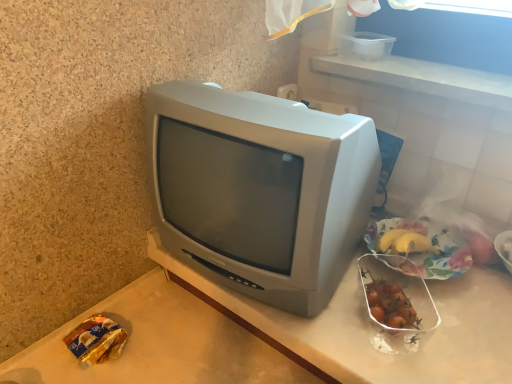
Question: From the image's perspective, is translucent plastic banana at upper right, the 4th food positioned from the left, beneath shiny plastic container of cherry tomatoes at right, the third food in the right-to-left sequence?

Choices:
 (A) yes
 (B) no

Answer: (B)

Question: Could you tell me if translucent plastic banana at upper right, the 4th food positioned from the left, is turned towards shiny plastic container of cherry tomatoes at right, arranged as the second food when viewed from the left?

Choices:
 (A) yes
 (B) no

Answer: (B)

Question: Considering the relative sizes of translucent plastic banana at upper right, the 4th food positioned from the left, and shiny plastic container of cherry tomatoes at right, arranged as the second food when viewed from the left, in the image provided, is translucent plastic banana at upper right, the 4th food positioned from the left, wider than shiny plastic container of cherry tomatoes at right, arranged as the second food when viewed from the left,?

Choices:
 (A) yes
 (B) no

Answer: (B)

Question: Is translucent plastic banana at upper right, the 1th food positioned from the right, taller than shiny plastic container of cherry tomatoes at right, the third food in the right-to-left sequence?

Choices:
 (A) yes
 (B) no

Answer: (A)

Question: Would you say translucent plastic banana at upper right, the 4th food positioned from the left, is outside shiny plastic container of cherry tomatoes at right, arranged as the second food when viewed from the left?

Choices:
 (A) yes
 (B) no

Answer: (A)

Question: From their relative heights in the image, would you say matte gray television at center is taller or shorter than yellow matte bananas at right, the third food in the left-to-right sequence?

Choices:
 (A) short
 (B) tall

Answer: (B)

Question: Based on their sizes in the image, would you say matte gray television at center is bigger or smaller than yellow matte bananas at right, which appears as the second food when viewed from the right?

Choices:
 (A) big
 (B) small

Answer: (A)

Question: Is point (199, 192) positioned closer to the camera than point (441, 253)?

Choices:
 (A) farther
 (B) closer

Answer: (B)

Question: Do you think matte gray television at center is within yellow matte bananas at right, the third food in the left-to-right sequence, or outside of it?

Choices:
 (A) outside
 (B) inside

Answer: (A)

Question: Visually, is yellow matte bananas at right, which appears as the second food when viewed from the right, positioned to the left or to the right of shiny plastic container of cherry tomatoes at right, the third food in the right-to-left sequence?

Choices:
 (A) left
 (B) right

Answer: (B)

Question: From a real-world perspective, is yellow matte bananas at right, the third food in the left-to-right sequence, above or below shiny plastic container of cherry tomatoes at right, the third food in the right-to-left sequence?

Choices:
 (A) below
 (B) above

Answer: (B)

Question: From the image's perspective, is yellow matte bananas at right, the third food in the left-to-right sequence, above or below shiny plastic container of cherry tomatoes at right, the third food in the right-to-left sequence?

Choices:
 (A) below
 (B) above

Answer: (B)

Question: Considering the positions of yellow matte bananas at right, which appears as the second food when viewed from the right, and shiny plastic container of cherry tomatoes at right, the third food in the right-to-left sequence, in the image, is yellow matte bananas at right, which appears as the second food when viewed from the right, bigger or smaller than shiny plastic container of cherry tomatoes at right, the third food in the right-to-left sequence,?

Choices:
 (A) big
 (B) small

Answer: (A)

Question: Relative to shiny plastic container of cherry tomatoes at right, arranged as the second food when viewed from the left, is translucent plastic banana at upper right, the 4th food positioned from the left, in front or behind?

Choices:
 (A) behind
 (B) front

Answer: (A)

Question: From their relative heights in the image, would you say translucent plastic banana at upper right, the 1th food positioned from the right, is taller or shorter than shiny plastic container of cherry tomatoes at right, arranged as the second food when viewed from the left?

Choices:
 (A) tall
 (B) short

Answer: (A)